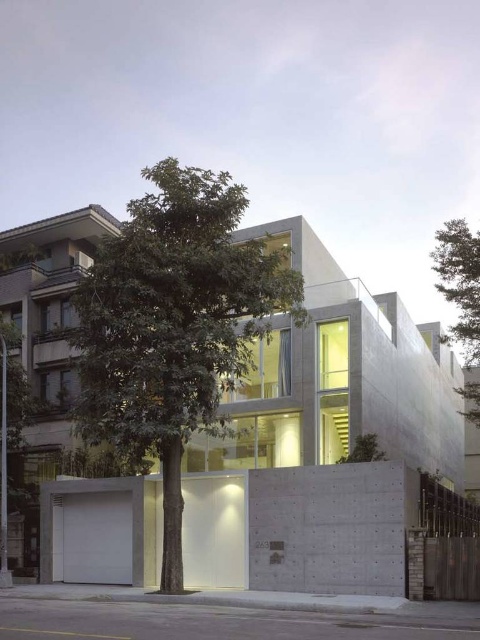
Question: Among these objects, which one is farthest from the camera?

Choices:
 (A) green leafy tree at upper right
 (B) green leafy tree at center

Answer: (A)

Question: Which point is closer to the camera?

Choices:
 (A) green leafy tree at upper right
 (B) green leafy tree at center

Answer: (B)

Question: Can you confirm if green leafy tree at center is positioned above green leafy tree at upper right?

Choices:
 (A) yes
 (B) no

Answer: (B)

Question: Can you confirm if green leafy tree at center is positioned below green leafy tree at upper right?

Choices:
 (A) no
 (B) yes

Answer: (B)

Question: In this image, where is green leafy tree at center located relative to green leafy tree at upper right?

Choices:
 (A) right
 (B) left

Answer: (B)

Question: Among these objects, which one is nearest to the camera?

Choices:
 (A) green leafy tree at upper right
 (B) green leafy tree at center

Answer: (B)